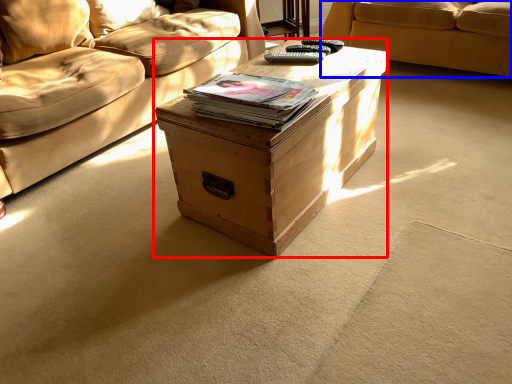
Question: Which point is closer to the camera, table (highlighted by a red box) or studio couch (highlighted by a blue box)?

Choices:
 (A) table
 (B) studio couch

Answer: (A)